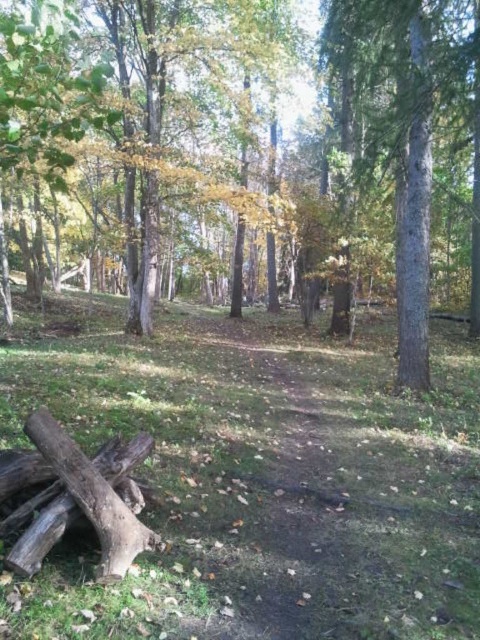
Question: Among these points, which one is nearest to the camera?

Choices:
 (A) (175, 36)
 (B) (421, 353)
 (C) (33, 572)
 (D) (421, 438)

Answer: (C)

Question: Which point is farther from the camera taking this photo?

Choices:
 (A) (108, 588)
 (B) (38, 445)

Answer: (B)

Question: Does brown rough wood at lower left lie behind smooth gray tree trunk at right?

Choices:
 (A) no
 (B) yes

Answer: (A)

Question: Which object is closer to the camera taking this photo?

Choices:
 (A) brown wood tree at center
 (B) brown rough wood at lower left
 (C) smooth gray tree trunk at right

Answer: (B)

Question: Does brown wood tree at center come in front of smooth gray tree trunk at right?

Choices:
 (A) no
 (B) yes

Answer: (B)

Question: Does brown wood tree at center appear on the left side of brown rough wood at lower left?

Choices:
 (A) no
 (B) yes

Answer: (A)